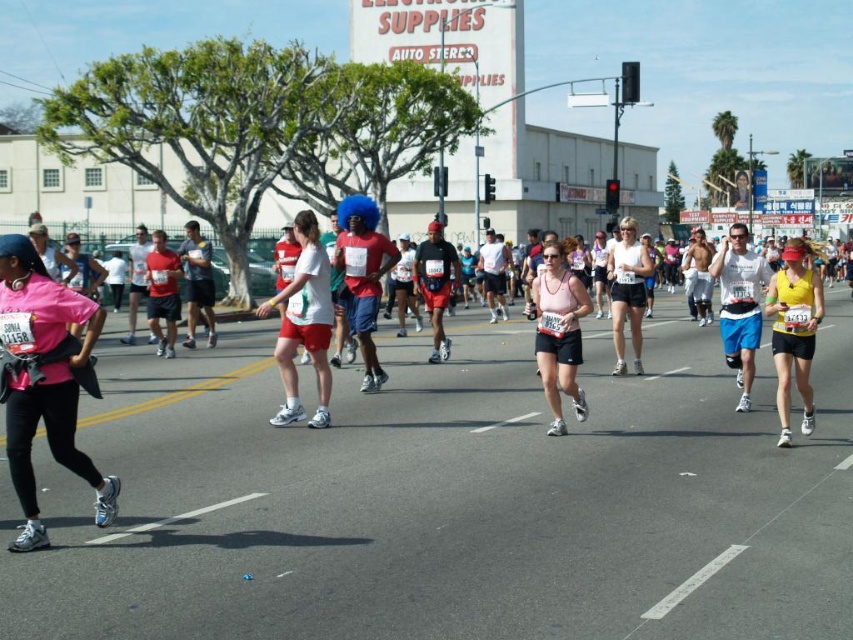
Can you confirm if pink matte shirt at left is positioned to the right of matte pink tank top at center?

No, pink matte shirt at left is not to the right of matte pink tank top at center.

Is point (3, 300) more distant than point (611, 257)?

No, (3, 300) is closer to viewer.

Identify the location of pink matte shirt at left. Image resolution: width=853 pixels, height=640 pixels. (44, 380).

Is point (323, 282) farther from viewer compared to point (618, 268)?

No, it is in front of (618, 268).

Who is more distant from viewer, (286, 348) or (625, 227)?

Positioned behind is point (625, 227).

Where is `white matte shorts at center`? white matte shorts at center is located at coordinates (305, 323).

Is yellow matte tank top at center smaller than matte pink tank top at center?

Indeed, yellow matte tank top at center has a smaller size compared to matte pink tank top at center.

Which of these two, yellow matte tank top at center or matte pink tank top at center, stands shorter?

yellow matte tank top at center

Where is `yellow matte tank top at center`? Image resolution: width=853 pixels, height=640 pixels. yellow matte tank top at center is located at coordinates (793, 330).